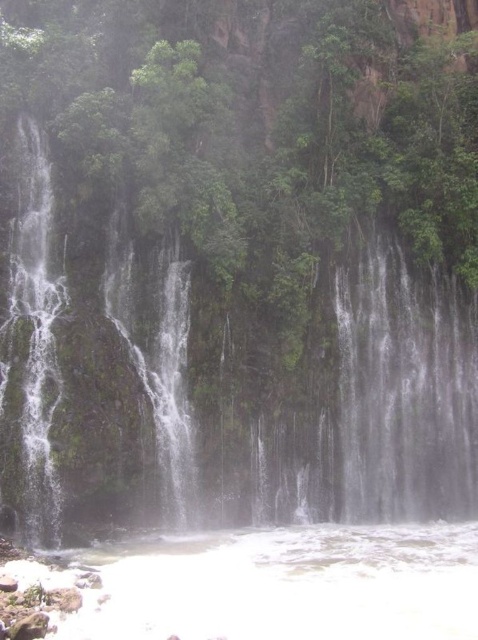
Question: Which of the following is the closest to the observer?

Choices:
 (A) white frothy water at bottom
 (B) white frothy water at center

Answer: (A)

Question: Is white frothy water at center positioned behind white frothy water at bottom?

Choices:
 (A) no
 (B) yes

Answer: (B)

Question: Which object appears farthest from the camera in this image?

Choices:
 (A) white frothy water at bottom
 (B) white frothy water at center

Answer: (B)

Question: Which point is closer to the camera?

Choices:
 (A) white frothy water at bottom
 (B) white frothy water at center

Answer: (A)

Question: Observing the image, what is the correct spatial positioning of white frothy water at center in reference to white frothy water at bottom?

Choices:
 (A) left
 (B) right

Answer: (A)

Question: Is white frothy water at center further to the viewer compared to white frothy water at bottom?

Choices:
 (A) no
 (B) yes

Answer: (B)